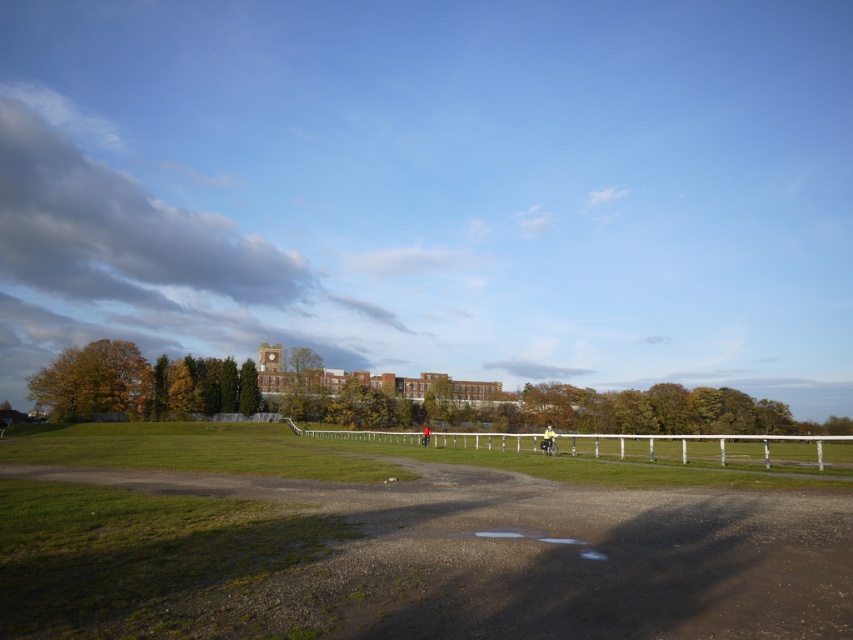
You are standing at the lower center of the image and want to walk along the dirt track at lower center towards the large red brick building with a clock tower. Which direction should you walk relative to the white wooden fence at center?

The dirt track at lower center is positioned on the left side of the white wooden fence at center. To walk towards the large red brick building with a clock tower, you should walk to the left of the white wooden fence at center.